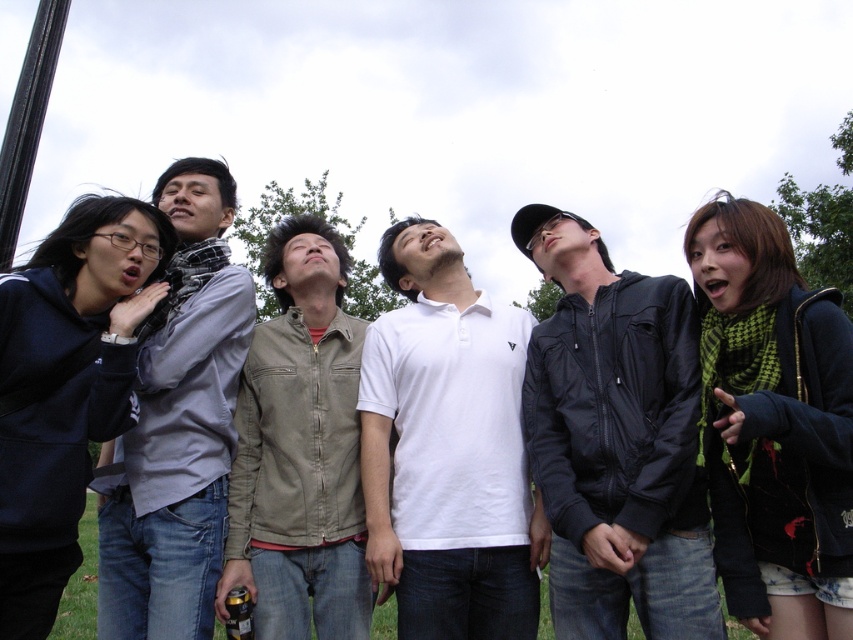
You are a photographer trying to capture a group photo of the matte gray scarf at left and the khaki cotton vest at center. The camera you are using has a minimum focusing distance of 60 centimeters. Can you take a clear photo of both subjects without moving them?

The distance between the matte gray scarf at left and the khaki cotton vest at center is 58.62 centimeters. Since this distance is less than the camera minimum focusing distance of 60 centimeters, you cannot take a clear photo of both subjects without moving them.

You are standing in the park and see the matte gray scarf at left. Can you estimate how far it is from the pole on the left side of the image?

The matte gray scarf at left is located at point (x=178, y=424), which is approximately 66.4 centimeters from the pole on the left side of the image.

You are a photographer trying to capture a closeup of the green checkered scarf at upper right without including the black leather jacket at center in the frame. Given their sizes, is this possible?

The black leather jacket at center is larger in size than the green checkered scarf at upper right. Since the jacket is bigger, it might block the view of the scarf depending on their positions. However, since the scarf is at upper right and the jacket is at center, you can adjust your angle to focus on the upper right area, excluding the jacket by moving the camera upwards or to the right. This should allow you to capture the scarf without the jacket in the frame.